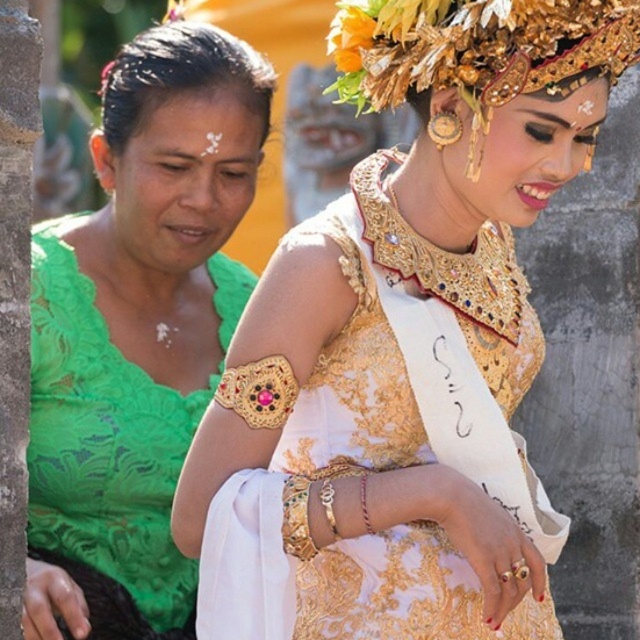
Question: Which point is closer to the camera?

Choices:
 (A) matte green blouse at left
 (B) gold metallic headdress at upper center
 (C) green lace blouse at left

Answer: (B)

Question: Can you confirm if gold textured dress at center is wider than gold metallic headdress at upper center?

Choices:
 (A) no
 (B) yes

Answer: (B)

Question: Is gold metallic headdress at upper center smaller than matte green blouse at left?

Choices:
 (A) no
 (B) yes

Answer: (B)

Question: Is gold metallic headdress at upper center below matte green blouse at left?

Choices:
 (A) yes
 (B) no

Answer: (A)

Question: Which object is the closest to the gold textured dress at center?

Choices:
 (A) green lace blouse at left
 (B) gold metallic headdress at upper center

Answer: (B)

Question: Estimate the real-world distances between objects in this image. Which object is farther from the green lace blouse at left?

Choices:
 (A) gold metallic headdress at upper center
 (B) matte green blouse at left

Answer: (A)